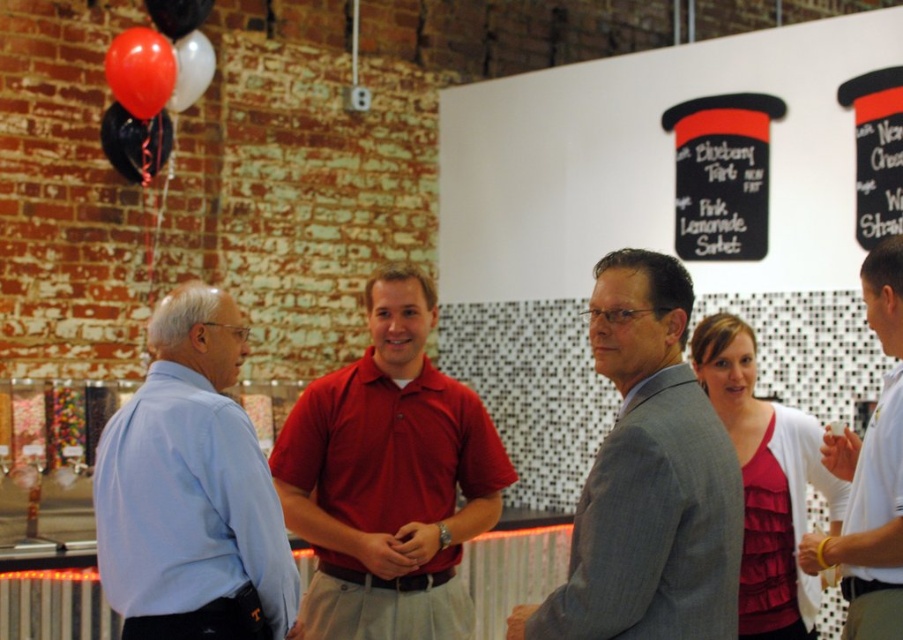
Is white cotton shirt at right bigger than rubber balloon at upper left?

Correct, white cotton shirt at right is larger in size than rubber balloon at upper left.

Is white cotton shirt at right above rubber balloon at upper left?

Incorrect, white cotton shirt at right is not positioned above rubber balloon at upper left.

Which is in front, point (881, 300) or point (145, 29)?

Point (881, 300) is more forward.

Image resolution: width=903 pixels, height=640 pixels. What are the coordinates of `white cotton shirt at right` in the screenshot? It's located at (870, 474).

Is matte red polo shirt at center wider than matte black balloon at upper left?

Yes, matte red polo shirt at center is wider than matte black balloon at upper left.

Is point (310, 442) positioned behind point (191, 32)?

That is False.

I want to click on matte red polo shirt at center, so (x=389, y=477).

Identify the location of matte red polo shirt at center. This screenshot has height=640, width=903. (389, 477).

Does shiny black balloon at upper left have a lesser width compared to black glossy balloon at upper left?

Incorrect, shiny black balloon at upper left's width is not less than black glossy balloon at upper left's.

Between point (107, 136) and point (163, 20), which one is positioned behind?

The point (107, 136) is behind.

Between point (157, 156) and point (202, 12), which one is positioned behind?

The point (157, 156) is behind.

Where is `shiny black balloon at upper left`? The width and height of the screenshot is (903, 640). shiny black balloon at upper left is located at coordinates (135, 141).